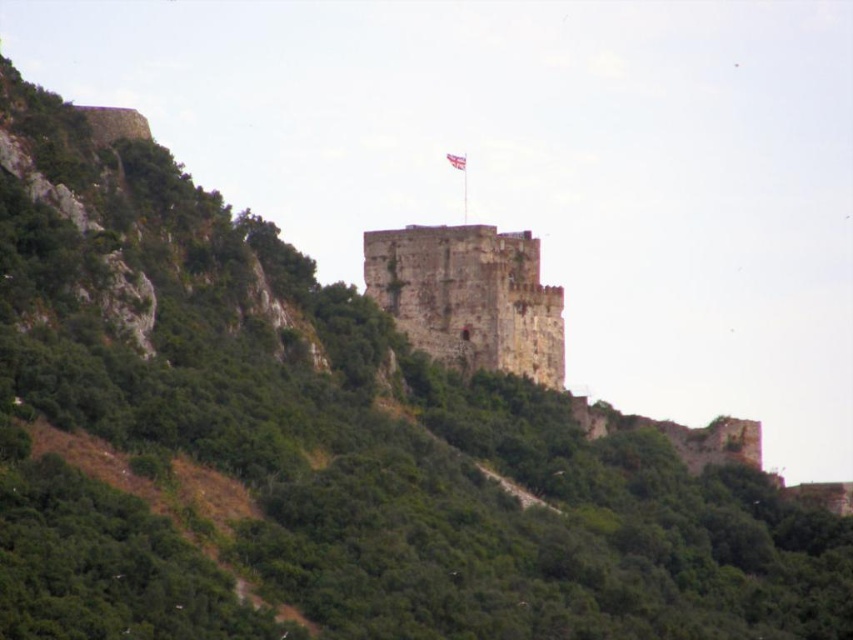
This screenshot has width=853, height=640. What do you see at coordinates (469, 296) in the screenshot?
I see `rusty stone tower at center` at bounding box center [469, 296].

In order to click on rusty stone tower at center in this screenshot , I will do `click(469, 296)`.